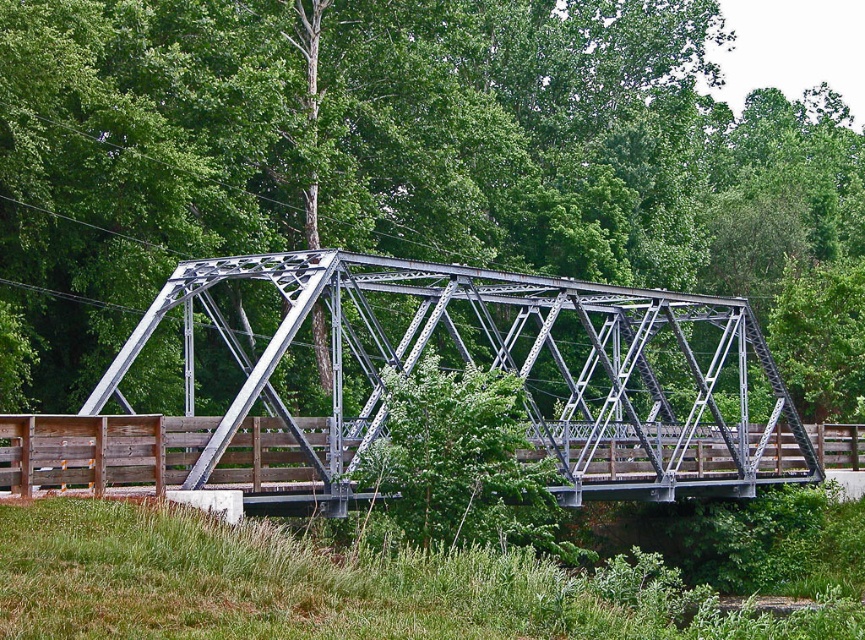
Identify the location of green leafy tree at center. The image size is (865, 640). (404, 161).

Is green leafy tree at center to the right of metallic gray bridge at center from the viewer's perspective?

Indeed, green leafy tree at center is positioned on the right side of metallic gray bridge at center.

Does point (802, 404) lie in front of point (221, 339)?

No, it is behind (221, 339).

Find the location of a particular element. green leafy tree at center is located at coordinates [404, 161].